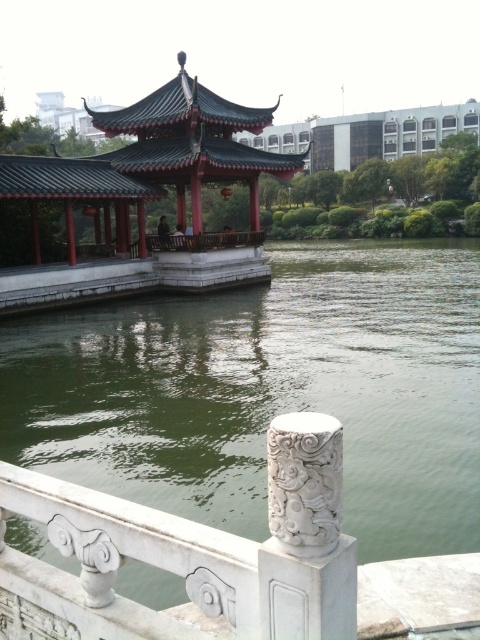
Which is in front, point (360, 380) or point (186, 102)?

Positioned in front is point (360, 380).

Does green stone water at center have a larger size compared to shiny red gazebo at center?

Incorrect, green stone water at center is not larger than shiny red gazebo at center.

Locate an element on the screen. green stone water at center is located at coordinates (268, 392).

Where is `green stone water at center`? The height and width of the screenshot is (640, 480). green stone water at center is located at coordinates (268, 392).